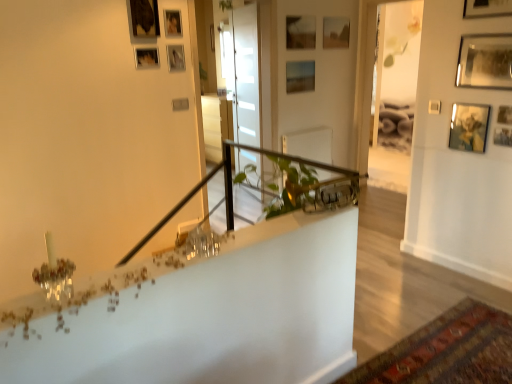
Question: Can you confirm if wooden picture frame at upper right, which ranks as the eleventh picture frame in left-to-right order, is positioned to the left of wooden picture frame at upper center, which ranks as the 9th picture frame in front-to-back order?

Choices:
 (A) yes
 (B) no

Answer: (B)

Question: Does wooden picture frame at upper right, the 9th picture frame from the back, have a greater height compared to wooden picture frame at upper center, which ranks as the 9th picture frame in front-to-back order?

Choices:
 (A) no
 (B) yes

Answer: (A)

Question: From a real-world perspective, is wooden picture frame at upper right, the 1th picture frame positioned from the right, located beneath wooden picture frame at upper center, which is counted as the 7th picture frame, starting from the right?

Choices:
 (A) no
 (B) yes

Answer: (B)

Question: Does wooden picture frame at upper right, which ranks as the eleventh picture frame in left-to-right order, turn towards wooden picture frame at upper center, which is counted as the 7th picture frame, starting from the right?

Choices:
 (A) yes
 (B) no

Answer: (B)

Question: Can you confirm if wooden picture frame at upper right, the 1th picture frame positioned from the right, is smaller than wooden picture frame at upper center, arranged as the third picture frame when viewed from the back?

Choices:
 (A) yes
 (B) no

Answer: (A)

Question: Considering the positions of point (144, 18) and point (180, 36), is point (144, 18) closer or farther from the camera than point (180, 36)?

Choices:
 (A) closer
 (B) farther

Answer: (A)

Question: Looking at their shapes, would you say wooden picture frame at upper left, which ranks as the seventh picture frame in back-to-front order, is wider or thinner than matte wooden picture frame at upper center, acting as the 9th picture frame starting from the right?

Choices:
 (A) wide
 (B) thin

Answer: (A)

Question: Considering the relative positions of wooden picture frame at upper left, the second picture frame from the left, and matte wooden picture frame at upper center, which ranks as the 7th picture frame in front-to-back order, in the image provided, is wooden picture frame at upper left, the second picture frame from the left, to the left or to the right of matte wooden picture frame at upper center, which ranks as the 7th picture frame in front-to-back order,?

Choices:
 (A) right
 (B) left

Answer: (B)

Question: Is wooden picture frame at upper left, the 10th picture frame viewed from the right, situated inside matte wooden picture frame at upper center, which is counted as the 3th picture frame, starting from the left, or outside?

Choices:
 (A) outside
 (B) inside

Answer: (A)

Question: From a real-world perspective, relative to matte wooden picture frame at upper center, the eleventh picture frame viewed from the front, is wooden picture frame at upper center, which is counted as the 7th picture frame, starting from the right, vertically above or below?

Choices:
 (A) below
 (B) above

Answer: (B)

Question: Looking at the image, does wooden picture frame at upper center, which is counted as the 7th picture frame, starting from the right, seem bigger or smaller compared to matte wooden picture frame at upper center, arranged as the 1th picture frame when viewed from the back?

Choices:
 (A) small
 (B) big

Answer: (A)

Question: Considering the positions of wooden picture frame at upper center, which ranks as the 9th picture frame in front-to-back order, and matte wooden picture frame at upper center, the fifth picture frame in the right-to-left sequence, in the image, is wooden picture frame at upper center, which ranks as the 9th picture frame in front-to-back order, taller or shorter than matte wooden picture frame at upper center, the fifth picture frame in the right-to-left sequence,?

Choices:
 (A) tall
 (B) short

Answer: (B)

Question: In the image, is wooden picture frame at upper center, which ranks as the 9th picture frame in front-to-back order, positioned in front of or behind matte wooden picture frame at upper center, arranged as the 1th picture frame when viewed from the back?

Choices:
 (A) front
 (B) behind

Answer: (A)

Question: In the image, is wooden picture frame at upper center, the sixth picture frame viewed from the front, positioned in front of or behind matte wooden picture frame at upper center, positioned as the sixth picture frame in right-to-left order?

Choices:
 (A) front
 (B) behind

Answer: (A)

Question: Looking at the image, does wooden picture frame at upper center, the sixth picture frame in the back-to-front sequence, seem bigger or smaller compared to matte wooden picture frame at upper center, the 6th picture frame from the left?

Choices:
 (A) big
 (B) small

Answer: (B)